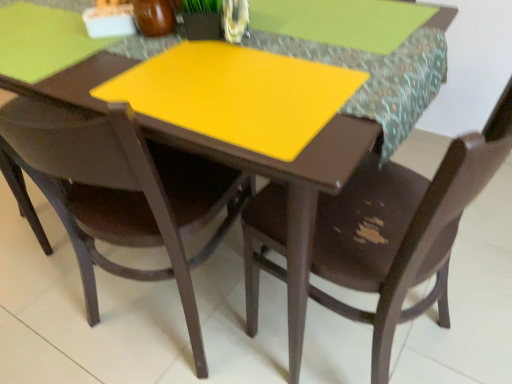
Find the location of `vacant area on top of yellow matte placemat at center (from a real-world perspective)`. vacant area on top of yellow matte placemat at center (from a real-world perspective) is located at coordinates (231, 36).